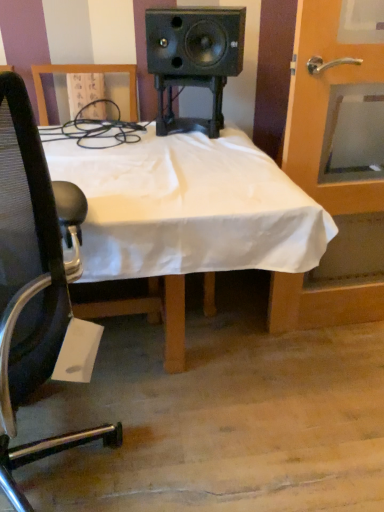
This screenshot has width=384, height=512. In order to click on free space on the front side of wooden door at right in this screenshot , I will do `click(338, 374)`.